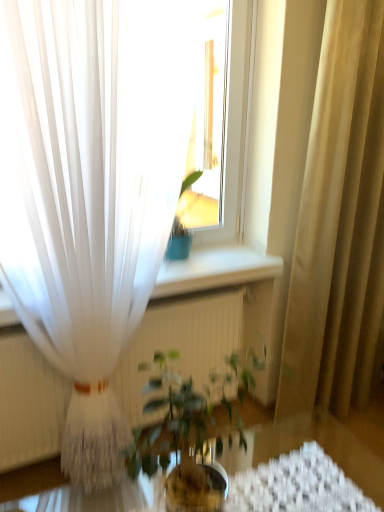
Question: Does transparent glass table at center appear on the right side of white sheer curtain at left, which is the second curtain from right to left?

Choices:
 (A) yes
 (B) no

Answer: (A)

Question: Are transparent glass table at center and white sheer curtain at left, which is the second curtain from right to left, beside each other?

Choices:
 (A) yes
 (B) no

Answer: (B)

Question: Does transparent glass table at center appear on the left side of white sheer curtain at left, which is the second curtain from right to left?

Choices:
 (A) yes
 (B) no

Answer: (B)

Question: Is transparent glass table at center not near white sheer curtain at left, which is the second curtain from right to left?

Choices:
 (A) yes
 (B) no

Answer: (A)

Question: Considering the relative sizes of transparent glass table at center and white sheer curtain at left, which is the second curtain from right to left, in the image provided, is transparent glass table at center bigger than white sheer curtain at left, which is the second curtain from right to left,?

Choices:
 (A) no
 (B) yes

Answer: (A)

Question: From the image's perspective, is transparent glass table at center above white sheer curtain at left, which appears as the first curtain when viewed from the left?

Choices:
 (A) yes
 (B) no

Answer: (B)

Question: Considering the relative positions of transparent glass table at center and beige fabric curtain at right, which is the 1th curtain in right-to-left order, in the image provided, is transparent glass table at center to the left of beige fabric curtain at right, which is the 1th curtain in right-to-left order, from the viewer's perspective?

Choices:
 (A) no
 (B) yes

Answer: (B)

Question: From a real-world perspective, is transparent glass table at center physically below beige fabric curtain at right, which is the 1th curtain in right-to-left order?

Choices:
 (A) yes
 (B) no

Answer: (A)

Question: Does transparent glass table at center touch beige fabric curtain at right, which is the 1th curtain in right-to-left order?

Choices:
 (A) no
 (B) yes

Answer: (A)

Question: From a real-world perspective, is transparent glass table at center on top of beige fabric curtain at right, which is the 1th curtain in right-to-left order?

Choices:
 (A) no
 (B) yes

Answer: (A)

Question: Can you confirm if transparent glass table at center is smaller than beige fabric curtain at right, the second curtain viewed from the left?

Choices:
 (A) no
 (B) yes

Answer: (B)

Question: Are transparent glass table at center and beige fabric curtain at right, the second curtain viewed from the left, far apart?

Choices:
 (A) no
 (B) yes

Answer: (A)

Question: Considering the relative positions of beige fabric curtain at right, the second curtain viewed from the left, and white sheer curtain at left, which appears as the first curtain when viewed from the left, in the image provided, is beige fabric curtain at right, the second curtain viewed from the left, to the right of white sheer curtain at left, which appears as the first curtain when viewed from the left, from the viewer's perspective?

Choices:
 (A) yes
 (B) no

Answer: (A)